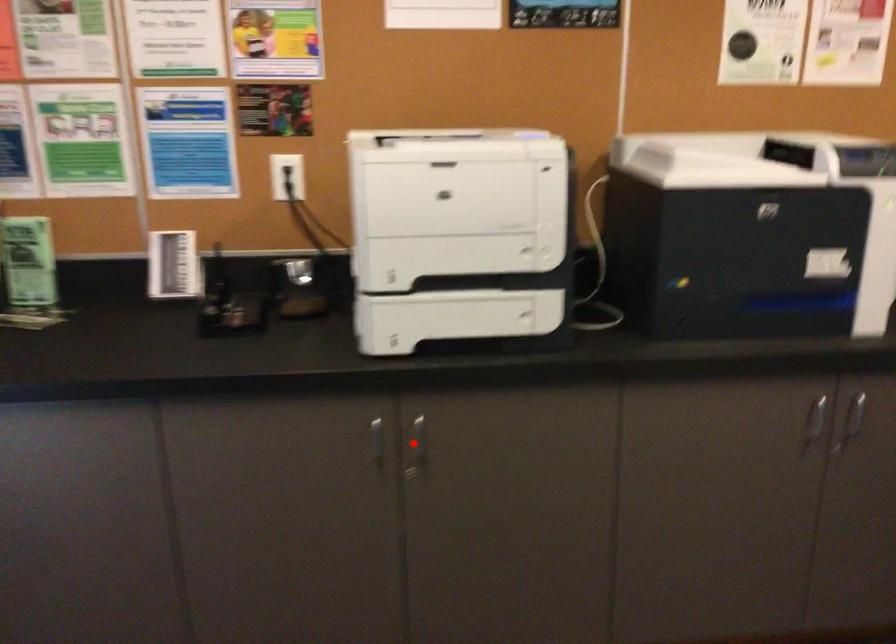
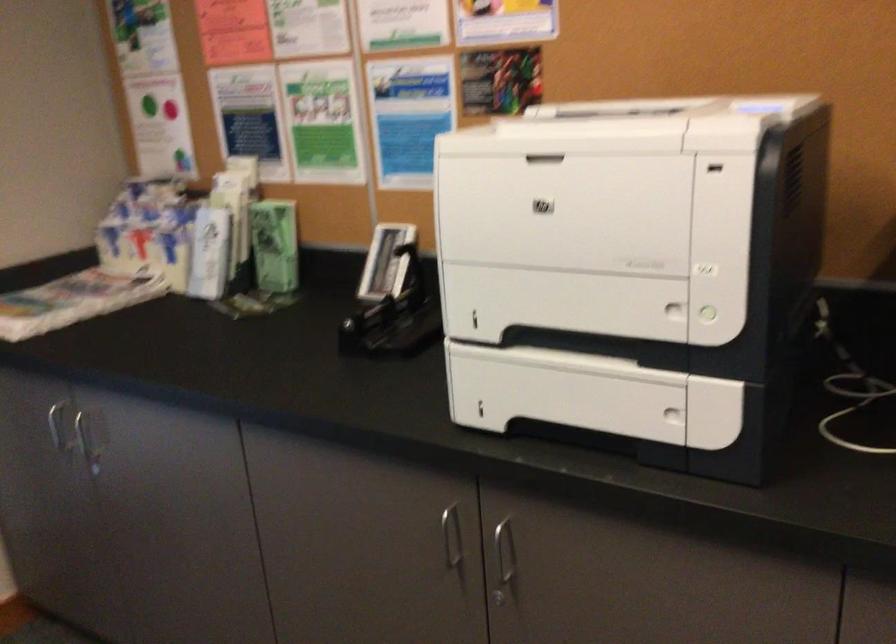
Question: A red point is marked in image1. In image2, is the corresponding 3D point closer to the camera or farther? Reply with the corresponding letter.

Choices:
 (A) The corresponding 3D point is closer.
 (B) The corresponding 3D point is farther.

Answer: (A)